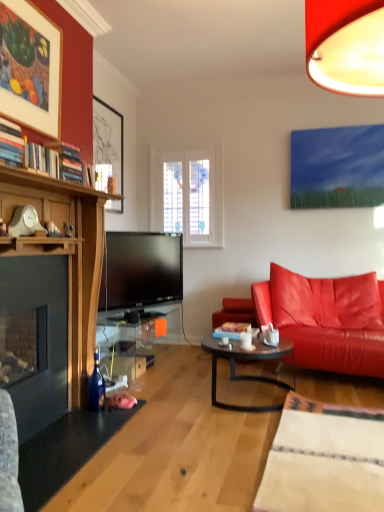
Question: From the image's perspective, is matte black picture frame at upper left, acting as the 1th picture frame starting from the back, positioned above or below white ceramic mug at center?

Choices:
 (A) above
 (B) below

Answer: (A)

Question: From their relative heights in the image, would you say matte black picture frame at upper left, acting as the 1th picture frame starting from the back, is taller or shorter than white ceramic mug at center?

Choices:
 (A) tall
 (B) short

Answer: (A)

Question: Estimate the real-world distances between objects in this image. Which object is farther from the dark brown glass coffee table at center?

Choices:
 (A) transparent glass table at lower center
 (B) matte wood picture frame at upper left, which is counted as the 1th picture frame, starting from the front
 (C) matte black picture frame at upper left, which is the second picture frame from front to back
 (D) white ceramic mug at center
 (E) leather couch at right

Answer: (C)

Question: Which is nearer to the matte black picture frame at upper left, which is the second picture frame from front to back?

Choices:
 (A) white ceramic mug at center
 (B) matte wood picture frame at upper left, the second picture frame positioned from the back
 (C) transparent glass table at lower center
 (D) dark brown glass coffee table at center
 (E) leather couch at right

Answer: (B)